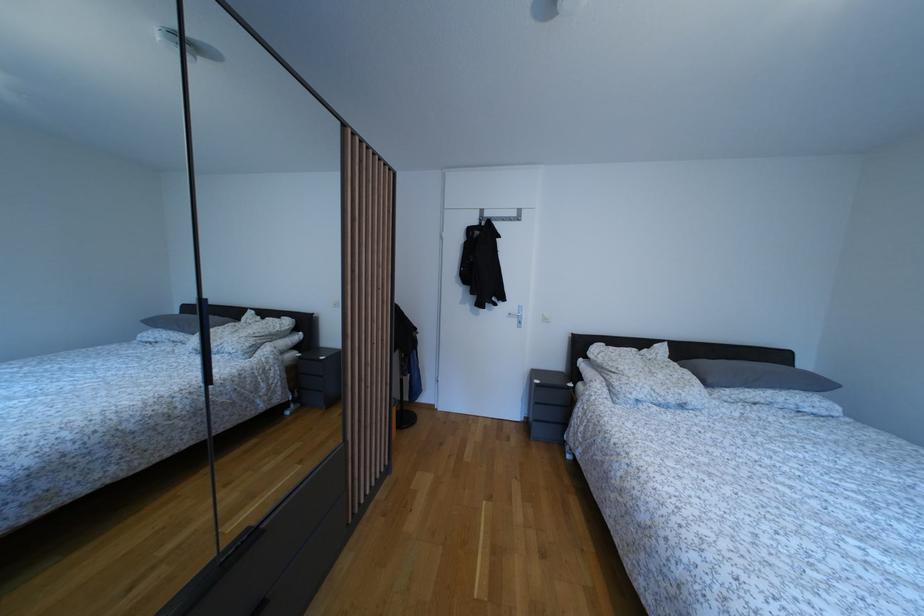
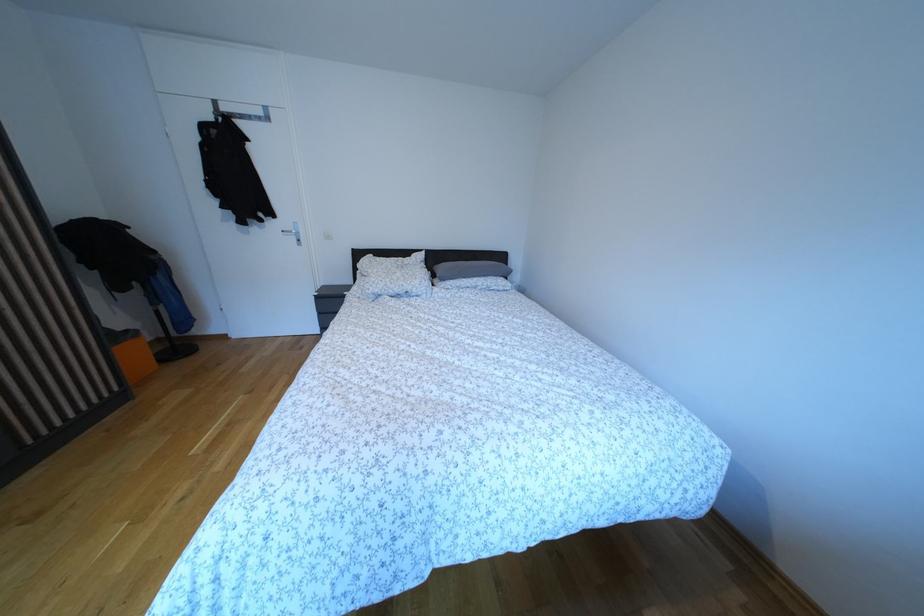
Locate, in the second image, the point that corresponds to pixel 667 383 in the first image.

(406, 281)